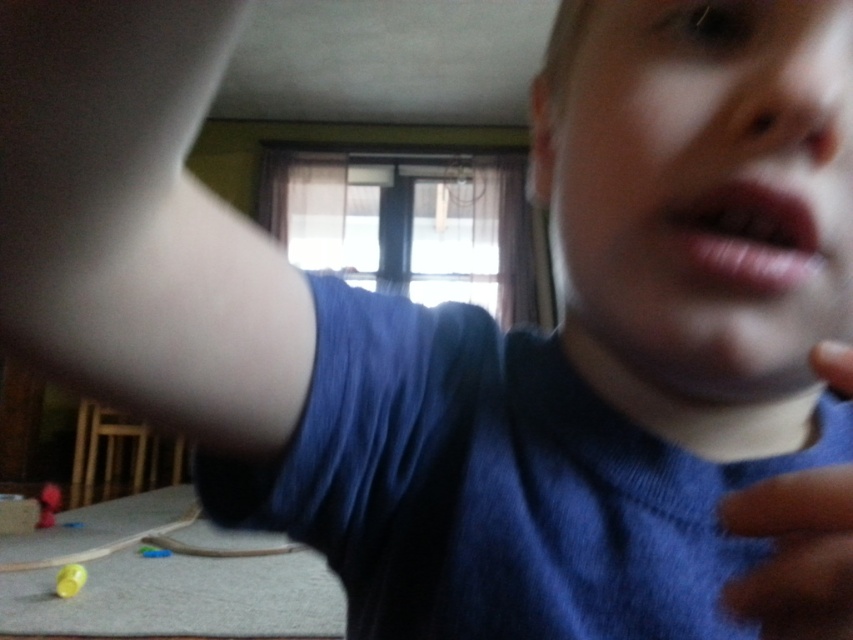
Question: Is blue fabric hand at lower right positioned in front of pink matte lips at center?

Choices:
 (A) yes
 (B) no

Answer: (A)

Question: Which point is closer to the camera?

Choices:
 (A) (790, 196)
 (B) (45, 522)
 (C) (62, 580)

Answer: (A)

Question: Is blue fabric hand at lower right further to the viewer compared to shiny yellow ball at lower left?

Choices:
 (A) yes
 (B) no

Answer: (B)

Question: Which object appears farthest from the camera in this image?

Choices:
 (A) shiny yellow ball at lower left
 (B) blue fabric hand at lower right

Answer: (A)

Question: Which point is closer to the camera?

Choices:
 (A) rubberized red ball at lower left
 (B) pink matte lips at center
 (C) shiny yellow ball at lower left

Answer: (B)

Question: Is pink matte lips at center wider than shiny yellow ball at lower left?

Choices:
 (A) no
 (B) yes

Answer: (A)